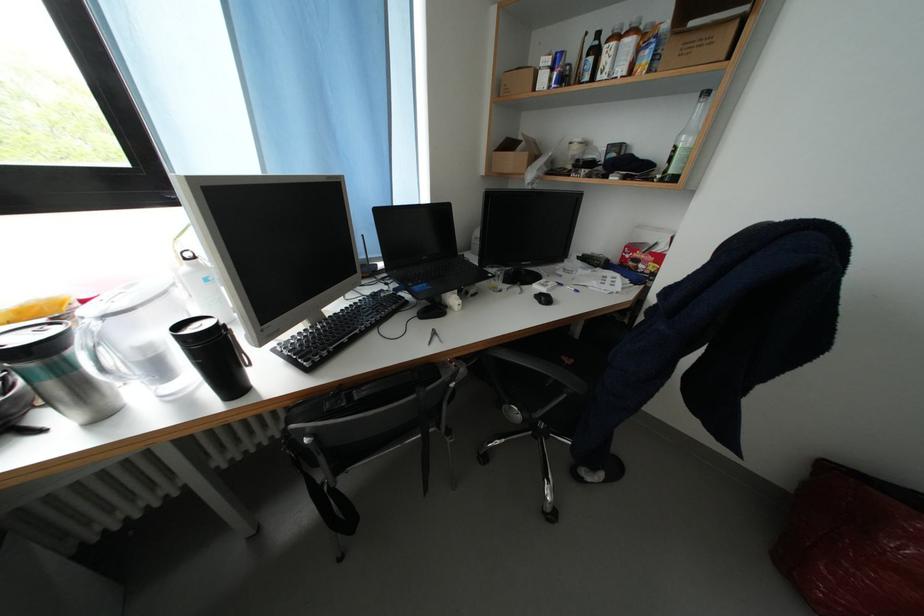
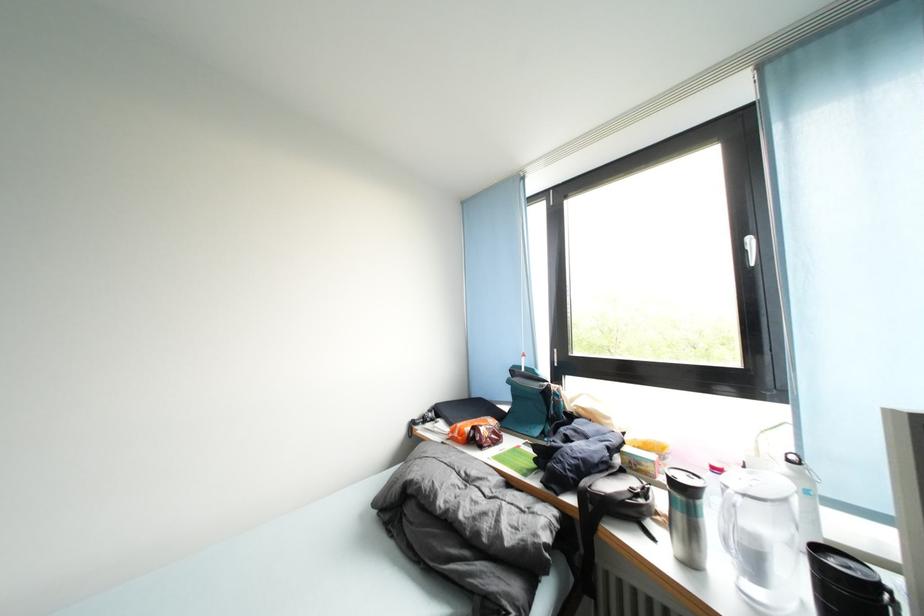
The point at (93, 307) is marked in the first image. Where is the corresponding point in the second image?

(723, 475)